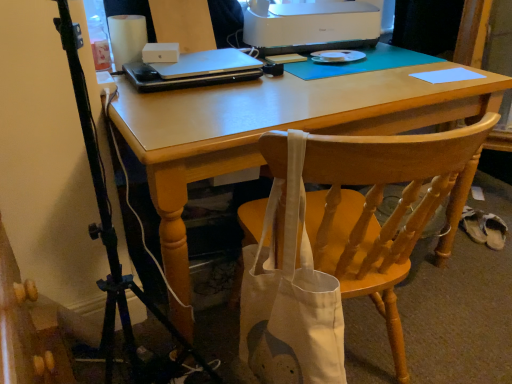
Question: From the image's perspective, is wooden chair at center located above matte wooden desk at center?

Choices:
 (A) no
 (B) yes

Answer: (A)

Question: Can you confirm if wooden chair at center is taller than matte wooden desk at center?

Choices:
 (A) yes
 (B) no

Answer: (B)

Question: Can you confirm if wooden chair at center is bigger than matte wooden desk at center?

Choices:
 (A) yes
 (B) no

Answer: (B)

Question: Is wooden chair at center located outside matte wooden desk at center?

Choices:
 (A) no
 (B) yes

Answer: (B)

Question: Is wooden chair at center in front of matte wooden desk at center?

Choices:
 (A) yes
 (B) no

Answer: (A)

Question: In terms of height, does matte wooden desk at center look taller or shorter compared to white plastic printer at upper center?

Choices:
 (A) tall
 (B) short

Answer: (A)

Question: From the image's perspective, is matte wooden desk at center located above or below white plastic printer at upper center?

Choices:
 (A) above
 (B) below

Answer: (B)

Question: Is matte wooden desk at center spatially inside white plastic printer at upper center, or outside of it?

Choices:
 (A) inside
 (B) outside

Answer: (B)

Question: Relative to white plastic printer at upper center, is matte wooden desk at center in front or behind?

Choices:
 (A) front
 (B) behind

Answer: (A)

Question: Is point (477, 77) positioned closer to the camera than point (352, 3)?

Choices:
 (A) farther
 (B) closer

Answer: (B)

Question: Relative to white plastic printer at upper center, is light blue paper at upper right in front or behind?

Choices:
 (A) front
 (B) behind

Answer: (A)

Question: Looking at their shapes, would you say light blue paper at upper right is wider or thinner than white plastic printer at upper center?

Choices:
 (A) wide
 (B) thin

Answer: (B)

Question: Would you say light blue paper at upper right is to the left or to the right of white plastic printer at upper center in the picture?

Choices:
 (A) left
 (B) right

Answer: (B)

Question: Would you say wooden chair at center is to the left or to the right of light blue paper at upper right in the picture?

Choices:
 (A) left
 (B) right

Answer: (A)

Question: Is wooden chair at center in front of or behind light blue paper at upper right in the image?

Choices:
 (A) behind
 (B) front

Answer: (B)